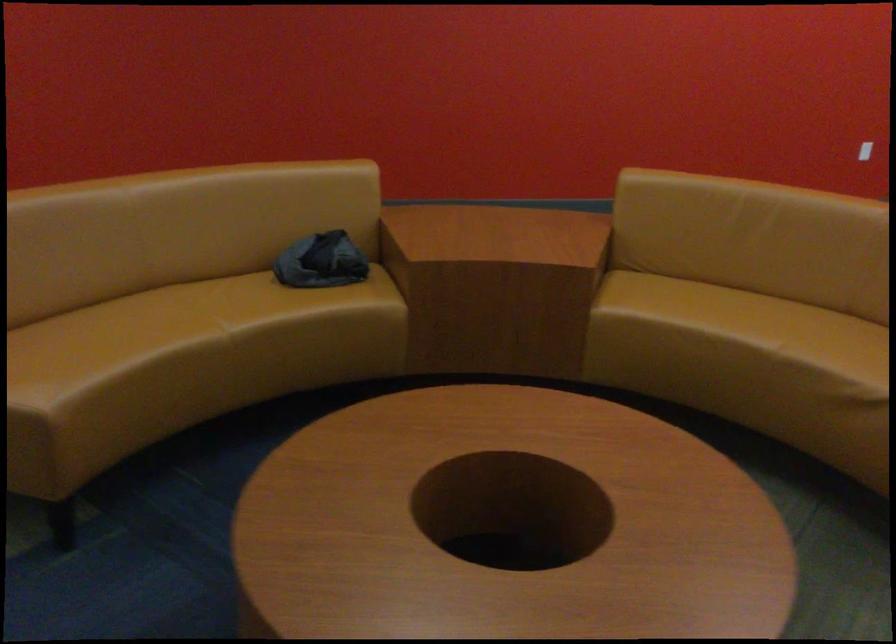
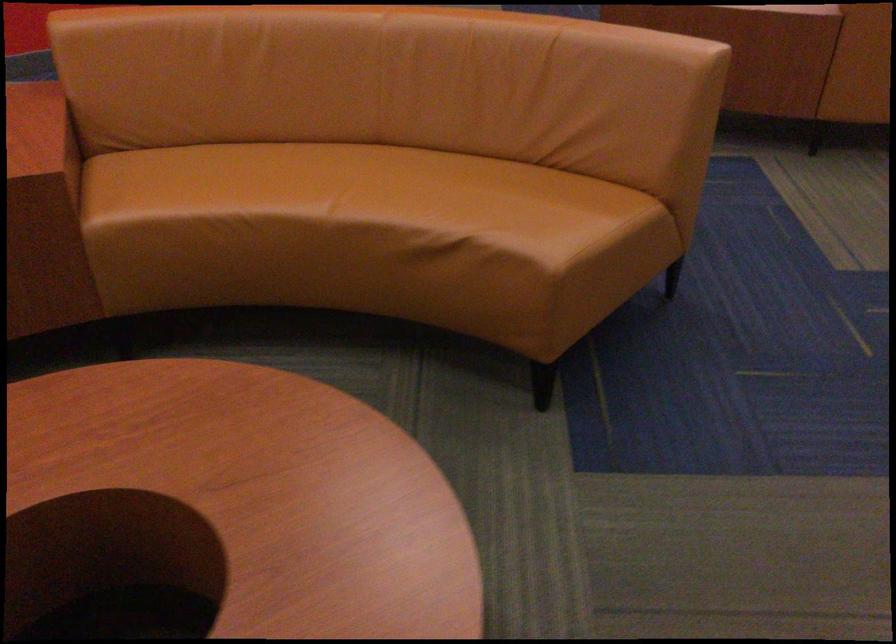
In the second image, find the point that corresponds to pixel 822 337 in the first image.

(359, 189)